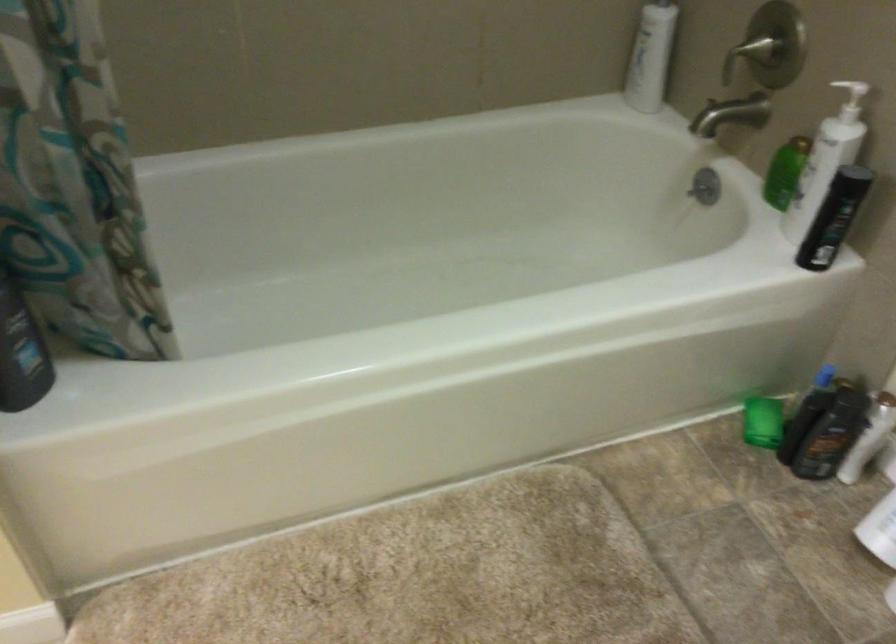
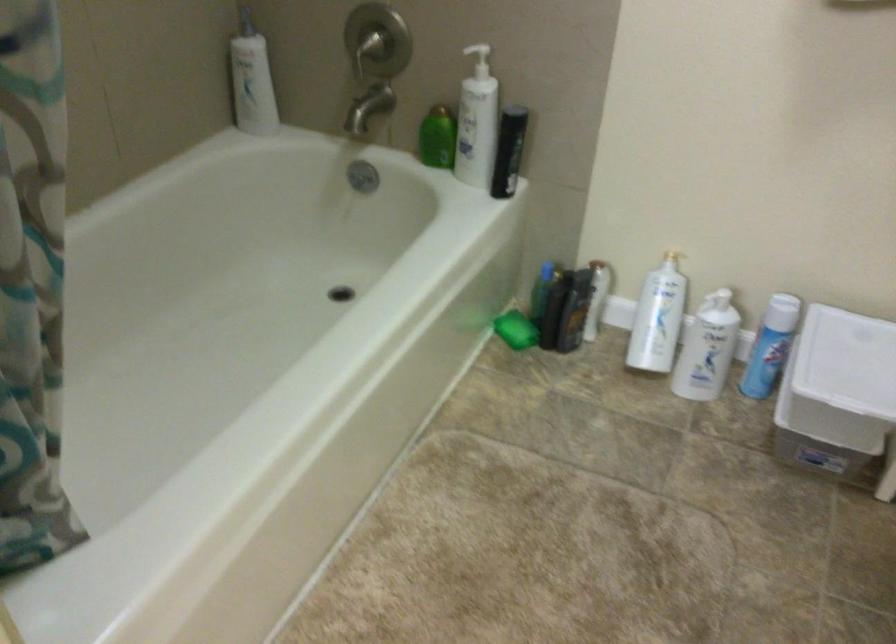
Where in the second image is the point corresponding to the point at 721,116 from the first image?

(368, 108)